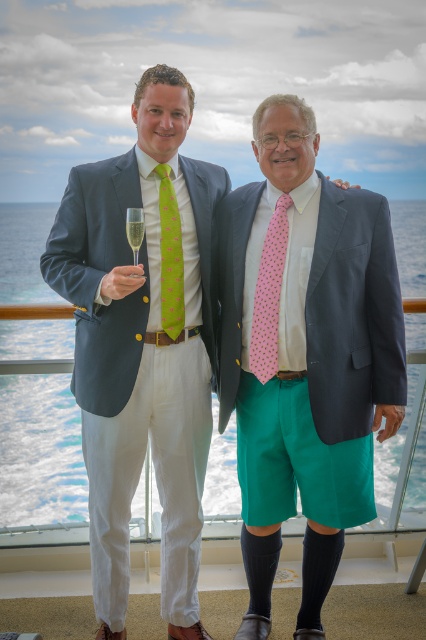
What do you see at coordinates (169, 257) in the screenshot?
I see `green printed tie at center` at bounding box center [169, 257].

In the scene shown: Who is shorter, green printed tie at center or clear glass at center?

clear glass at center

Identify the location of green printed tie at center. (169, 257).

Where is `green printed tie at center`? This screenshot has height=640, width=426. green printed tie at center is located at coordinates (169, 257).

Between pink dotted tie at center and pink printed tie at center, which one is positioned lower?

pink dotted tie at center is below.

I want to click on pink dotted tie at center, so click(305, 355).

You are a GUI agent. You are given a task and a screenshot of the screen. Output one action in this format:
    pyautogui.click(x=<x>, y=<y>)
    Task: Click on the pink dotted tie at center
    
    Given the screenshot: What is the action you would take?
    pyautogui.click(x=305, y=355)

Does pink printed tie at center have a lesser width compared to green printed tie at center?

No, pink printed tie at center is not thinner than green printed tie at center.

Does pink printed tie at center appear under green printed tie at center?

Yes, pink printed tie at center is below green printed tie at center.

Between point (281, 241) and point (169, 330), which one is positioned behind?

Positioned behind is point (169, 330).

At what (x,y) coordinates should I click in order to perform the action: click on pink printed tie at center. Please return your answer as a coordinate pair (x, y). The height and width of the screenshot is (640, 426). Looking at the image, I should click on (268, 294).